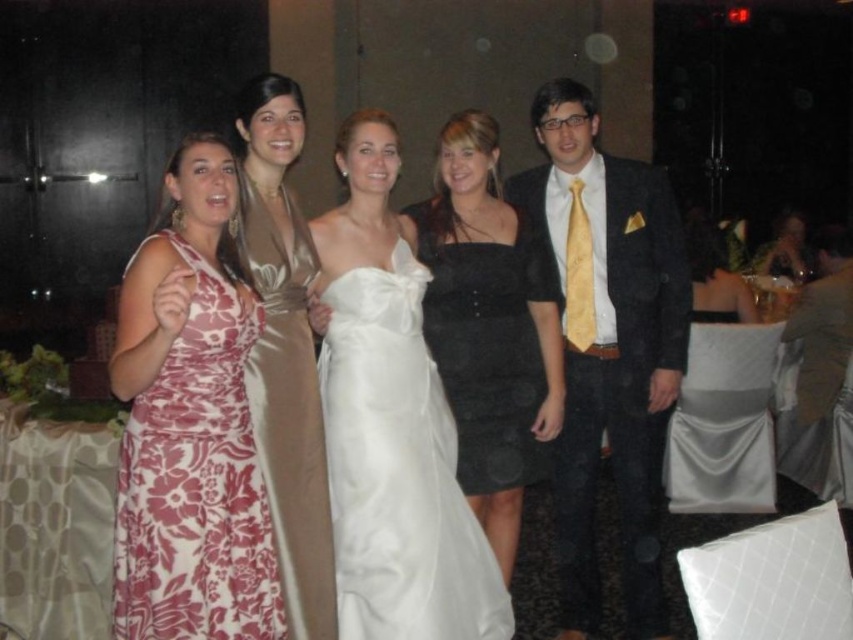
Question: Is white satin dress at center positioned in front of satin dress at center?

Choices:
 (A) yes
 (B) no

Answer: (B)

Question: Which of these objects is positioned farthest from the white satin dress at center?

Choices:
 (A) floral-patterned fabric dress at left
 (B) matte black suit at right
 (C) black satin dress at center

Answer: (B)

Question: Can you confirm if floral-patterned fabric dress at left is positioned below black satin dress at center?

Choices:
 (A) no
 (B) yes

Answer: (B)

Question: Estimate the real-world distances between objects in this image. Which object is farther from the black satin dress at center?

Choices:
 (A) floral-patterned fabric dress at left
 (B) satin dress at center
 (C) white satin dress at center

Answer: (A)

Question: Is floral-patterned fabric dress at left below satin dress at center?

Choices:
 (A) yes
 (B) no

Answer: (A)

Question: Which of the following is the closest to the observer?

Choices:
 (A) matte black suit at right
 (B) black satin dress at center

Answer: (B)